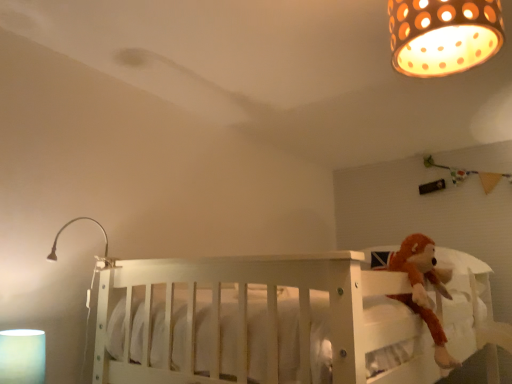
This screenshot has height=384, width=512. Describe the element at coordinates (443, 35) in the screenshot. I see `matte brown lampshade at upper right, the third lamp in the bottom-to-top sequence` at that location.

Locate an element on the screen. brown plush monkey at right is located at coordinates (420, 286).

The image size is (512, 384). Identify the location of matte brown lampshade at upper right, marked as the first lamp in a right-to-left arrangement. (443, 35).

From the picture: Is metallic silver lamp at upper left, acting as the second lamp starting from the left, inside the boundaries of white wooden crib at center, or outside?

metallic silver lamp at upper left, acting as the second lamp starting from the left, is not inside white wooden crib at center, it's outside.

Is metallic silver lamp at upper left, the third lamp from the front, positioned with its back to white wooden crib at center?

Yes, metallic silver lamp at upper left, the third lamp from the front, is positioned with its back facing white wooden crib at center.

Considering the sizes of objects metallic silver lamp at upper left, arranged as the 2th lamp when viewed from the top, and white wooden crib at center in the image provided, who is shorter, metallic silver lamp at upper left, arranged as the 2th lamp when viewed from the top, or white wooden crib at center?

With less height is metallic silver lamp at upper left, arranged as the 2th lamp when viewed from the top.

Which of these two, metallic silver lamp at upper left, arranged as the 2th lamp when viewed from the top, or brown plush monkey at right, is bigger?

brown plush monkey at right.

Between point (56, 236) and point (444, 358), which one is positioned behind?

The point (56, 236) is behind.

From the image's perspective, which one is positioned higher, metallic silver lamp at upper left, the third lamp from the front, or brown plush monkey at right?

metallic silver lamp at upper left, the third lamp from the front, from the image's perspective.

Can you confirm if metallic silver lamp at upper left, the second lamp in the bottom-to-top sequence, is taller than brown plush monkey at right?

No, metallic silver lamp at upper left, the second lamp in the bottom-to-top sequence, is not taller than brown plush monkey at right.

Is white matte cylinder at lower left, the third lamp in the right-to-left sequence, at the back of matte brown lampshade at upper right, the third lamp when ordered from back to front?

matte brown lampshade at upper right, the third lamp when ordered from back to front, does not have its back to white matte cylinder at lower left, the third lamp in the right-to-left sequence.

From the image's perspective, which is below, matte brown lampshade at upper right, marked as the first lamp in a right-to-left arrangement, or white matte cylinder at lower left, which is the 3th lamp from top to bottom?

white matte cylinder at lower left, which is the 3th lamp from top to bottom.

Based on the photo, who is bigger, matte brown lampshade at upper right, which appears as the third lamp when viewed from the left, or white matte cylinder at lower left, placed as the 1th lamp when sorted from left to right?

matte brown lampshade at upper right, which appears as the third lamp when viewed from the left, is bigger.

Which is in front, point (18, 365) or point (497, 375)?

Point (18, 365)

Considering the relative positions of white matte cylinder at lower left, the 2th lamp from the back, and white wooden crib at center in the image provided, is white matte cylinder at lower left, the 2th lamp from the back, behind white wooden crib at center?

Yes, white matte cylinder at lower left, the 2th lamp from the back, is further from the camera.

Who is bigger, white matte cylinder at lower left, which is the 3th lamp from top to bottom, or white wooden crib at center?

white wooden crib at center.

Is white matte cylinder at lower left, which is the 3th lamp from top to bottom, taller than white wooden crib at center?

Incorrect, the height of white matte cylinder at lower left, which is the 3th lamp from top to bottom, is not larger of that of white wooden crib at center.

Can you confirm if white matte cylinder at lower left, which is the 3th lamp from top to bottom, is smaller than brown plush monkey at right?

Yes, white matte cylinder at lower left, which is the 3th lamp from top to bottom, is smaller than brown plush monkey at right.

Considering the sizes of objects white matte cylinder at lower left, the third lamp in the right-to-left sequence, and brown plush monkey at right in the image provided, who is wider, white matte cylinder at lower left, the third lamp in the right-to-left sequence, or brown plush monkey at right?

brown plush monkey at right is wider.

At what (x,y) coordinates should I click in order to perform the action: click on the 3rd lamp to the left when counting from the brown plush monkey at right. Please return your answer as a coordinate pair (x, y). Looking at the image, I should click on (22, 356).

Is matte brown lampshade at upper right, the third lamp in the bottom-to-top sequence, to the left or to the right of metallic silver lamp at upper left, arranged as the 2th lamp when viewed from the top, in the image?

From the image, it's evident that matte brown lampshade at upper right, the third lamp in the bottom-to-top sequence, is to the right of metallic silver lamp at upper left, arranged as the 2th lamp when viewed from the top.

Considering the points (459, 35) and (76, 219), which point is behind, point (459, 35) or point (76, 219)?

The point (76, 219) is farther from the camera.

Can you tell me how much matte brown lampshade at upper right, the third lamp when ordered from back to front, and metallic silver lamp at upper left, the second lamp in the bottom-to-top sequence, differ in facing direction?

0.002 degrees.

In the scene shown: Would you say matte brown lampshade at upper right, the third lamp in the bottom-to-top sequence, is inside or outside metallic silver lamp at upper left, the second lamp in the bottom-to-top sequence?

matte brown lampshade at upper right, the third lamp in the bottom-to-top sequence, is outside metallic silver lamp at upper left, the second lamp in the bottom-to-top sequence.

What's the angular difference between brown plush monkey at right and white wooden crib at center's facing directions?

88.1 degrees.

Would you consider brown plush monkey at right to be distant from white wooden crib at center?

Actually, brown plush monkey at right and white wooden crib at center are a little close together.

Where is `infant bed lying in front of the brown plush monkey at right`? The image size is (512, 384). infant bed lying in front of the brown plush monkey at right is located at coordinates click(251, 321).

Which is behind, brown plush monkey at right or white wooden crib at center?

brown plush monkey at right is more distant.

What are the coordinates of `lamp that is the 2nd one when counting leftward from the white wooden crib at center` in the screenshot? It's located at (68, 225).

Find the location of `lamp behind the brown plush monkey at right`. lamp behind the brown plush monkey at right is located at coordinates (68, 225).

Based on their spatial positions, is matte brown lampshade at upper right, which appears as the third lamp when viewed from the left, or metallic silver lamp at upper left, arranged as the 2th lamp when viewed from the top, further from white matte cylinder at lower left, acting as the first lamp starting from the bottom?

matte brown lampshade at upper right, which appears as the third lamp when viewed from the left.

Looking at the image, which one is located further to brown plush monkey at right, metallic silver lamp at upper left, the second lamp in the bottom-to-top sequence, or white matte cylinder at lower left, the third lamp in the right-to-left sequence?

white matte cylinder at lower left, the third lamp in the right-to-left sequence, is further to brown plush monkey at right.

When comparing their distances from white matte cylinder at lower left, the 2th lamp from the back, does matte brown lampshade at upper right, the third lamp in the bottom-to-top sequence, or white wooden crib at center seem closer?

white wooden crib at center is positioned closer to the anchor white matte cylinder at lower left, the 2th lamp from the back.

From the image, which object appears to be farther from brown plush monkey at right, matte brown lampshade at upper right, marked as the first lamp in a top-to-bottom arrangement, or white wooden crib at center?

matte brown lampshade at upper right, marked as the first lamp in a top-to-bottom arrangement, is positioned further to the anchor brown plush monkey at right.

Estimate the real-world distances between objects in this image. Which object is further from matte brown lampshade at upper right, the third lamp when ordered from back to front, white matte cylinder at lower left, acting as the first lamp starting from the bottom, or brown plush monkey at right?

white matte cylinder at lower left, acting as the first lamp starting from the bottom, is further to matte brown lampshade at upper right, the third lamp when ordered from back to front.

Based on their spatial positions, is brown plush monkey at right or white wooden crib at center closer to white matte cylinder at lower left, acting as the first lamp starting from the bottom?

white wooden crib at center lies closer to white matte cylinder at lower left, acting as the first lamp starting from the bottom, than the other object.

Which object lies nearer to the anchor point white wooden crib at center, matte brown lampshade at upper right, marked as the first lamp in a top-to-bottom arrangement, or metallic silver lamp at upper left, positioned as the 2th lamp in right-to-left order?

matte brown lampshade at upper right, marked as the first lamp in a top-to-bottom arrangement.

Estimate the real-world distances between objects in this image. Which object is further from white wooden crib at center, white matte cylinder at lower left, the 2th lamp in the front-to-back sequence, or brown plush monkey at right?

Based on the image, white matte cylinder at lower left, the 2th lamp in the front-to-back sequence, appears to be further to white wooden crib at center.

Where is `toy situated between white matte cylinder at lower left, which is the 3th lamp from top to bottom, and white wooden crib at center from left to right`? The width and height of the screenshot is (512, 384). toy situated between white matte cylinder at lower left, which is the 3th lamp from top to bottom, and white wooden crib at center from left to right is located at coordinates tap(420, 286).

This screenshot has width=512, height=384. In order to click on toy that lies between matte brown lampshade at upper right, the third lamp in the bottom-to-top sequence, and white wooden crib at center from top to bottom in this screenshot , I will do `click(420, 286)`.

The width and height of the screenshot is (512, 384). Find the location of `lamp between white matte cylinder at lower left, the third lamp in the right-to-left sequence, and matte brown lampshade at upper right, the third lamp when ordered from back to front, from left to right`. lamp between white matte cylinder at lower left, the third lamp in the right-to-left sequence, and matte brown lampshade at upper right, the third lamp when ordered from back to front, from left to right is located at coordinates (68, 225).

The image size is (512, 384). In order to click on lamp between metallic silver lamp at upper left, the 1th lamp viewed from the back, and white wooden crib at center from left to right in this screenshot , I will do `click(443, 35)`.